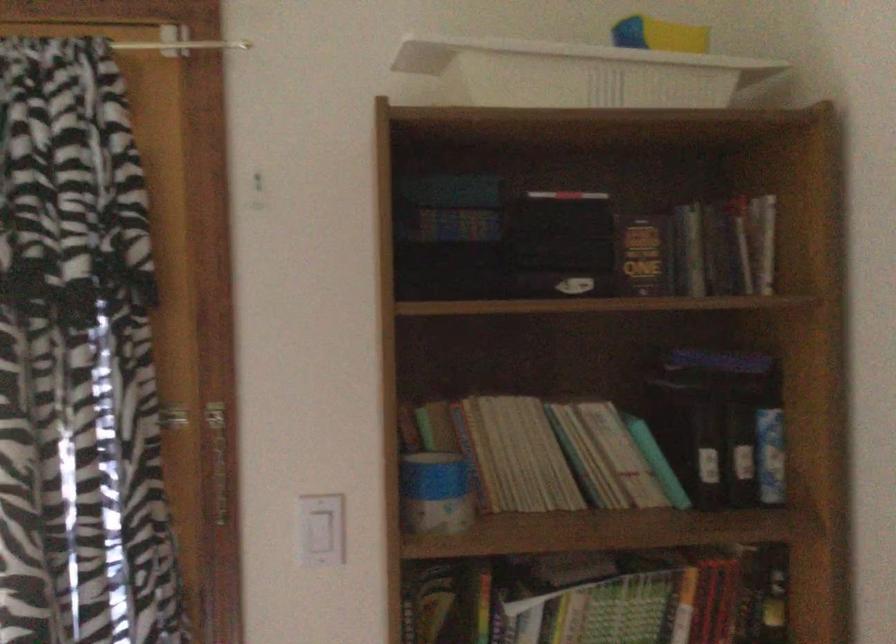
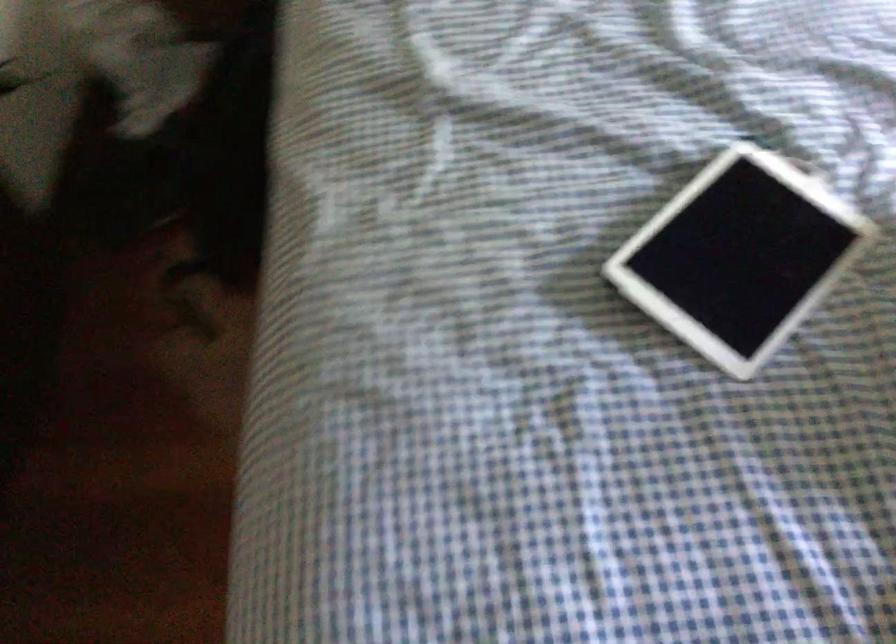
Based on the continuous images, in which direction is the camera rotating?

The camera's rotation is toward left-down.